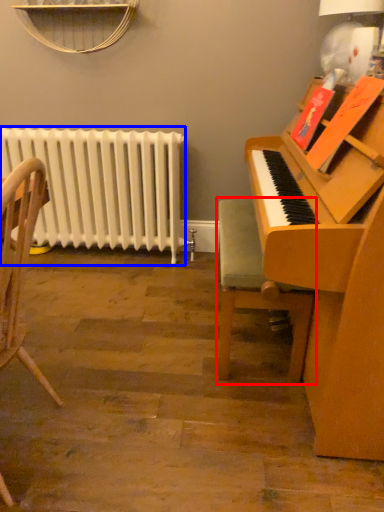
Question: Among these objects, which one is farthest to the camera, chair (highlighted by a red box) or radiator (highlighted by a blue box)?

Choices:
 (A) chair
 (B) radiator

Answer: (B)